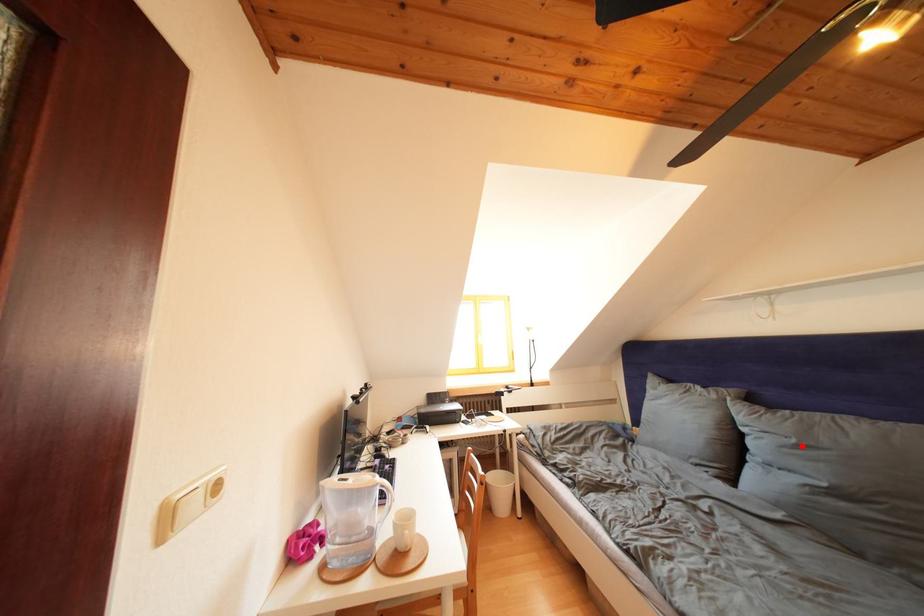
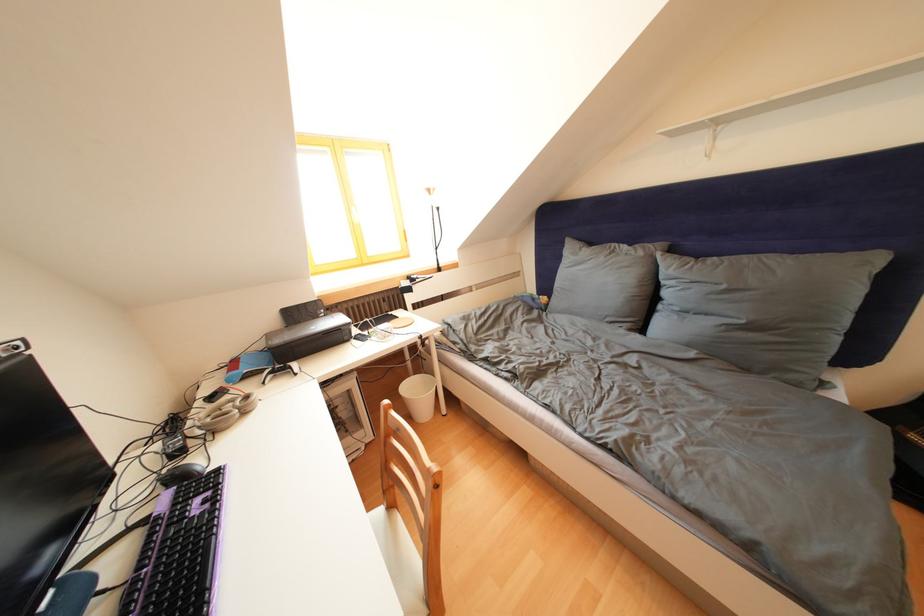
Where in the second image is the point corresponding to the highlighted location from the first image?

(733, 292)